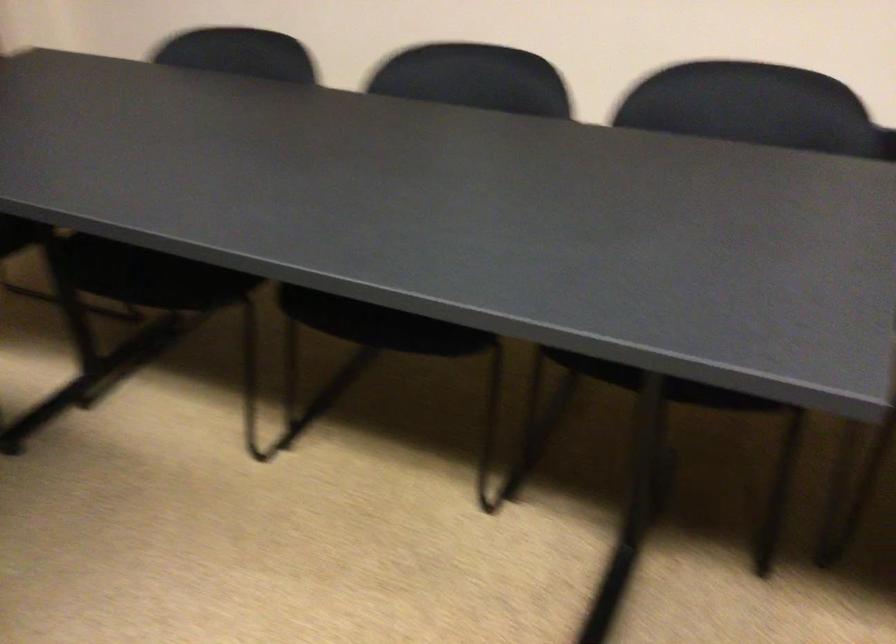
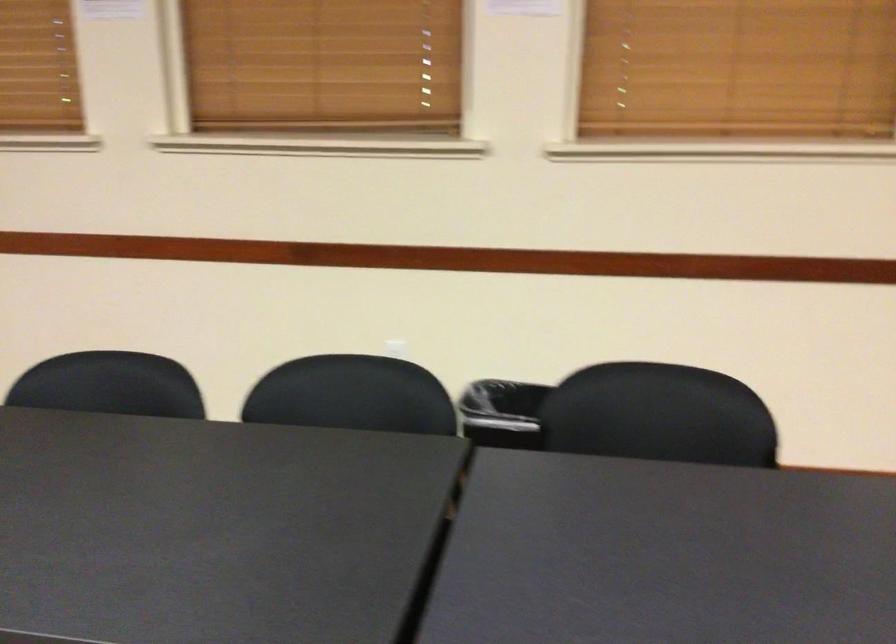
Which direction would the cameraman need to move to produce the second image?

The movement direction of the cameraman is right, backward.